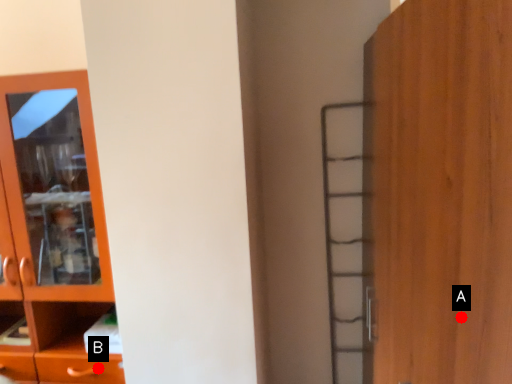
Question: Two points are circled on the image, labeled by A and B beside each circle. Which point is farther from the camera taking this photo?

Choices:
 (A) A is further
 (B) B is further

Answer: (B)